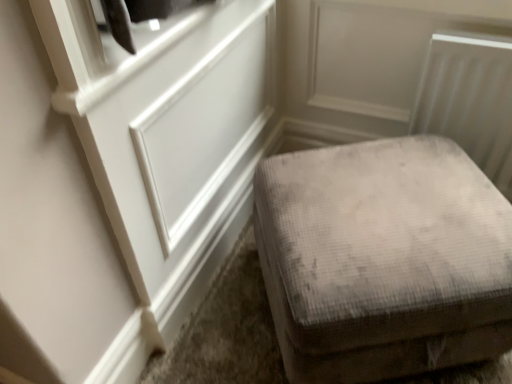
Question: Can you confirm if white paneling at upper left is positioned to the right of gray velvety ottoman at lower right?

Choices:
 (A) no
 (B) yes

Answer: (A)

Question: From a real-world perspective, does white paneling at upper left stand above gray velvety ottoman at lower right?

Choices:
 (A) no
 (B) yes

Answer: (B)

Question: Is white paneling at upper left facing away from gray velvety ottoman at lower right?

Choices:
 (A) no
 (B) yes

Answer: (B)

Question: Is white paneling at upper left smaller than gray velvety ottoman at lower right?

Choices:
 (A) yes
 (B) no

Answer: (A)

Question: Would you say white paneling at upper left contains gray velvety ottoman at lower right?

Choices:
 (A) no
 (B) yes

Answer: (A)

Question: Is white paneling at upper left in front of gray velvety ottoman at lower right?

Choices:
 (A) no
 (B) yes

Answer: (B)

Question: Does gray velvety ottoman at lower right turn towards white paneling at upper left?

Choices:
 (A) no
 (B) yes

Answer: (A)

Question: Are gray velvety ottoman at lower right and white paneling at upper left making contact?

Choices:
 (A) yes
 (B) no

Answer: (B)

Question: Does gray velvety ottoman at lower right have a larger size compared to white paneling at upper left?

Choices:
 (A) yes
 (B) no

Answer: (A)

Question: From the image's perspective, is gray velvety ottoman at lower right beneath white paneling at upper left?

Choices:
 (A) yes
 (B) no

Answer: (A)

Question: Is gray velvety ottoman at lower right at the left side of white paneling at upper left?

Choices:
 (A) no
 (B) yes

Answer: (A)

Question: From the image's perspective, is gray velvety ottoman at lower right on top of white paneling at upper left?

Choices:
 (A) no
 (B) yes

Answer: (A)

Question: Considering their positions, is gray velvety ottoman at lower right located in front of or behind white paneling at upper left?

Choices:
 (A) behind
 (B) front

Answer: (A)